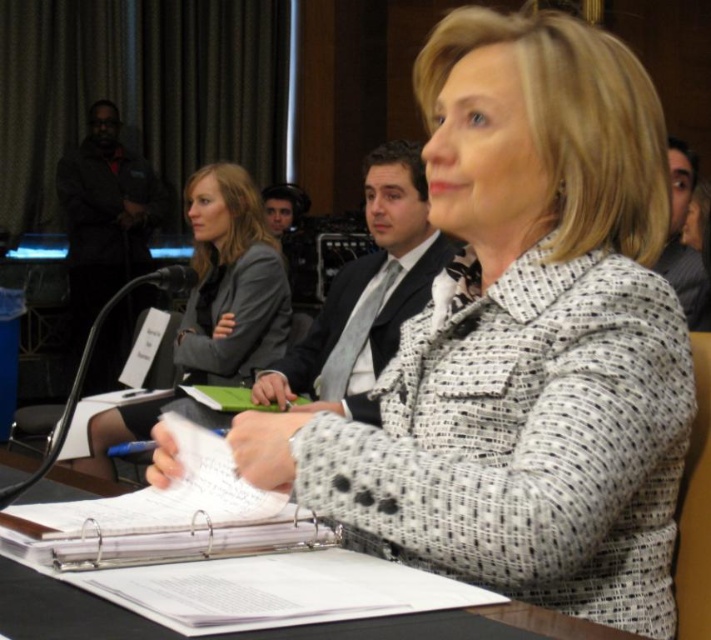
Question: Can you confirm if gray fabric jacket at upper left is positioned below black paper at center?

Choices:
 (A) no
 (B) yes

Answer: (A)

Question: Which is nearer to the black textured suit at center?

Choices:
 (A) white textured blazer at center
 (B) black paper at center

Answer: (A)

Question: Among these objects, which one is farthest from the camera?

Choices:
 (A) black paper at center
 (B) gray fabric jacket at upper left

Answer: (B)

Question: Is white textured blazer at center below gray fabric jacket at upper left?

Choices:
 (A) yes
 (B) no

Answer: (B)

Question: Is gray fabric jacket at upper left closer to camera compared to black paper at center?

Choices:
 (A) yes
 (B) no

Answer: (B)

Question: Among these objects, which one is nearest to the camera?

Choices:
 (A) gray fabric jacket at upper left
 (B) black textured suit at center
 (C) black paper at center
 (D) white textured blazer at center

Answer: (C)